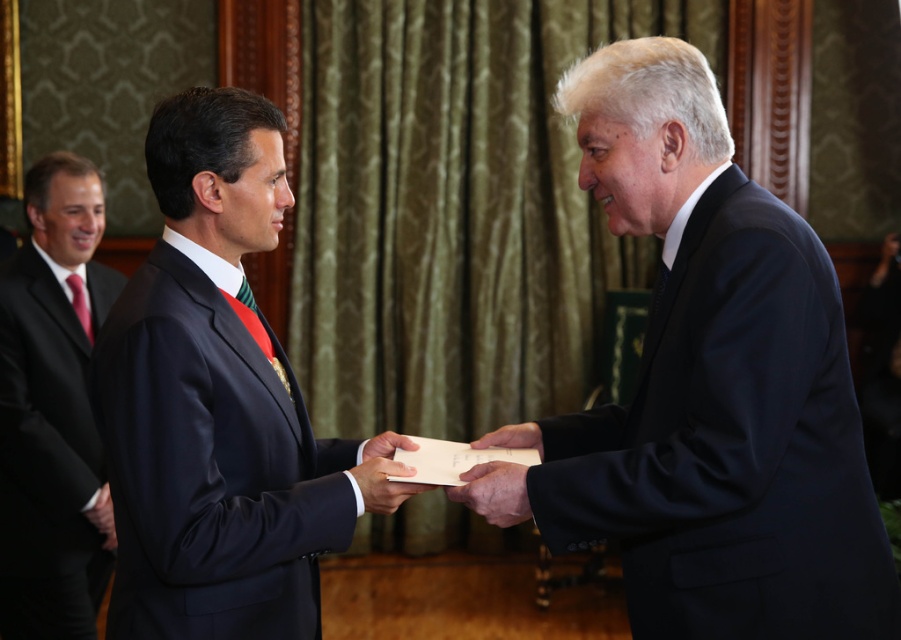
Question: Among these points, which one is farthest from the camera?

Choices:
 (A) (85, 324)
 (B) (87, 512)

Answer: (A)

Question: Which object is positioned closest to the matte black folder at center?

Choices:
 (A) matte black suit at left
 (B) white paper at center

Answer: (B)

Question: In this image, where is black matte suit at center located relative to red silk tie at left?

Choices:
 (A) below
 (B) above

Answer: (A)

Question: Which point is farther from the camera taking this photo?

Choices:
 (A) (68, 280)
 (B) (760, 349)
 (C) (71, 525)
 (D) (490, 436)

Answer: (A)

Question: Does black matte suit at center appear over matte black folder at center?

Choices:
 (A) no
 (B) yes

Answer: (B)

Question: Does matte black suit at center appear under black leather hand at center?

Choices:
 (A) no
 (B) yes

Answer: (A)